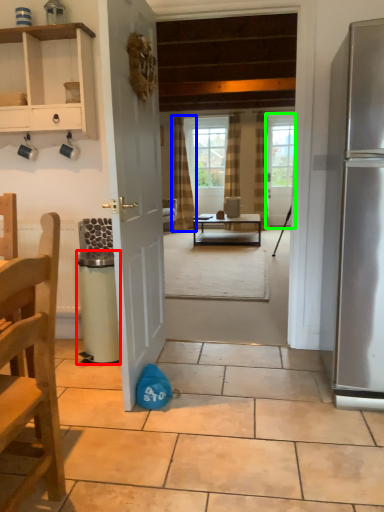
Question: Which object is the farthest from trash bin/can (highlighted by a red box)? Choose among these: curtain (highlighted by a blue box) or door (highlighted by a green box).

Choices:
 (A) curtain
 (B) door

Answer: (B)